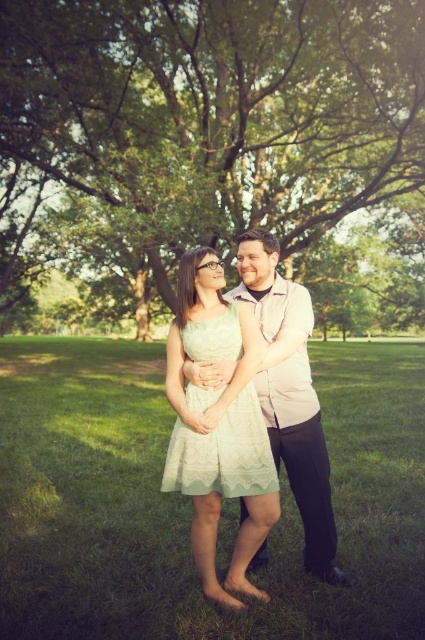
Based on the scene description, which object is taller between the green leafy tree at center and the lace fabric dress at center?

The green leafy tree at center is taller than the lace fabric dress at center.

You are a photographer planning to capture a portrait of the two people in the scene. To ensure the green leafy tree at center is not blocking the subjects, where should you position yourself relative to the tree?

To avoid blocking the subjects, position yourself to the left or right of the green leafy tree at center, which is located at coordinates point (218, 109). This will keep the tree out of the frame while capturing the two people.

You are a photographer trying to capture the light green lace dress at center and the green leafy tree at center in a single frame. Based on their positions, will the tree appear above the dress in your photo?

Yes, the green leafy tree at center is positioned over the light green lace dress at center, so it will appear above the dress in the photo.